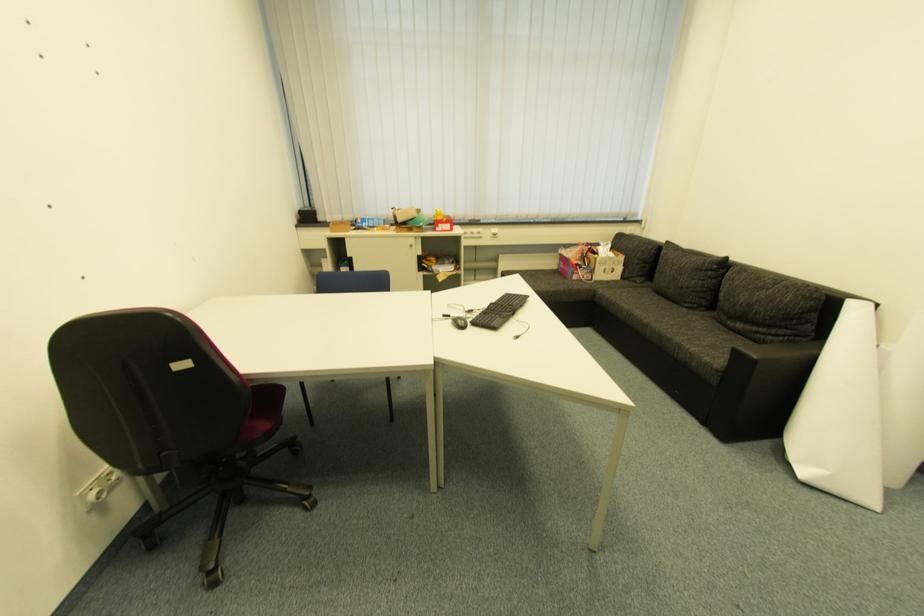
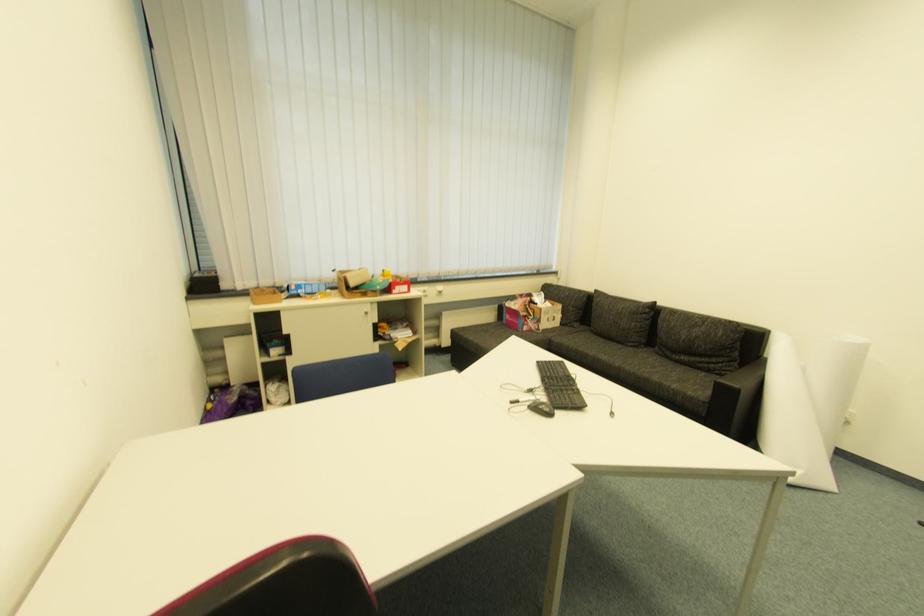
Question: The camera is either moving clockwise (left) or counter-clockwise (right) around the object. The first image is from the beginning of the video and the second image is from the end. Is the camera moving left or right when shooting the video?

Choices:
 (A) Left
 (B) Right

Answer: (A)